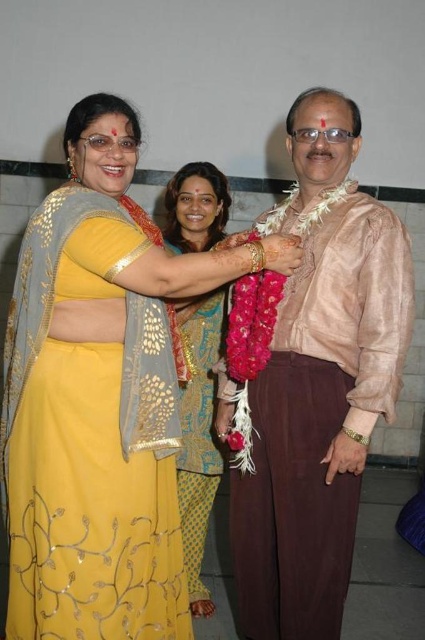
Question: Is yellow satin saree at center to the right of golden sequined saree at center from the viewer's perspective?

Choices:
 (A) no
 (B) yes

Answer: (A)

Question: Which point appears closest to the camera in this image?

Choices:
 (A) (206, 596)
 (B) (356, 330)
 (C) (107, 508)

Answer: (C)

Question: Does yellow satin saree at center appear on the left side of golden sequined saree at center?

Choices:
 (A) no
 (B) yes

Answer: (B)

Question: Which of the following is the farthest from the observer?

Choices:
 (A) (193, 388)
 (B) (294, 285)

Answer: (A)

Question: Does yellow satin saree at center appear over golden sequined saree at center?

Choices:
 (A) yes
 (B) no

Answer: (A)

Question: Which object appears closest to the camera in this image?

Choices:
 (A) pink silk shirt at center
 (B) yellow satin saree at center
 (C) golden sequined saree at center

Answer: (B)